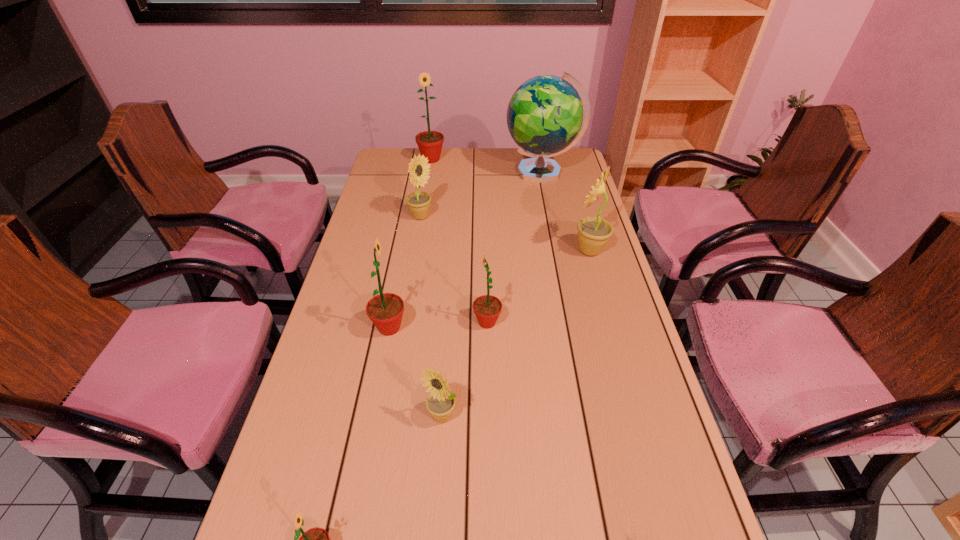
You are a GUI agent. You are given a task and a screenshot of the screen. Output one action in this format:
    pyautogui.click(x=<x>, y=<y>)
    Task: Click on the object that is the fifth closest to the nearest green sunflower
    Image resolution: width=960 pixels, height=540 pixels.
    Given the screenshot: What is the action you would take?
    pyautogui.click(x=418, y=202)

I want to click on sunflower that stands as the fifth closest to the rightmost sunflower, so click(x=430, y=143).

Locate which sunflower ranks in proximity to the second biggest green sunflower. Please provide its 2D coordinates. Your answer should be formatted as a tuple, i.e. [(x, y)], where the tuple contains the x and y coordinates of a point satisfying the conditions above.

[(487, 308)]

You are a GUI agent. You are given a task and a screenshot of the screen. Output one action in this format:
    pyautogui.click(x=<x>, y=<y>)
    Task: Click on the green sunflower that is the second closest one to the second nearest yellow sunflower
    
    Given the screenshot: What is the action you would take?
    tap(385, 310)

You are a GUI agent. You are given a task and a screenshot of the screen. Output one action in this format:
    pyautogui.click(x=<x>, y=<y>)
    Task: Click on the green sunflower that is the closest to the nearest green sunflower
    The height and width of the screenshot is (540, 960).
    Given the screenshot: What is the action you would take?
    tap(385, 310)

I want to click on the closest yellow sunflower to the nearest yellow sunflower, so click(x=593, y=232).

At what (x,y) coordinates should I click in order to perform the action: click on the second closest yellow sunflower to the leftmost yellow sunflower. Please return your answer as a coordinate pair (x, y). The width and height of the screenshot is (960, 540). Looking at the image, I should click on (440, 403).

Identify the location of vacant space that satisfies the following two spatial constraints: 1. on the face of the rightmost sunflower; 2. on the face of the second nearest object. (636, 416).